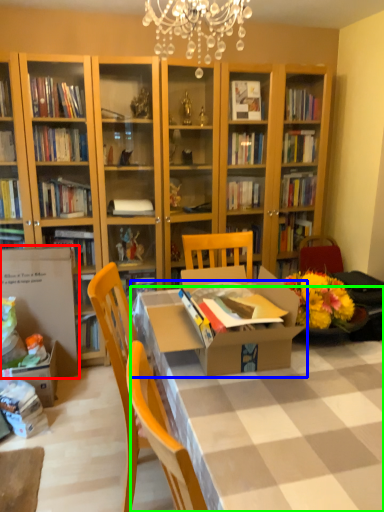
Question: Considering the real-world distances, which object is closest to cardboard box (highlighted by a red box)? table (highlighted by a blue box) or desk (highlighted by a green box).

Choices:
 (A) table
 (B) desk

Answer: (A)